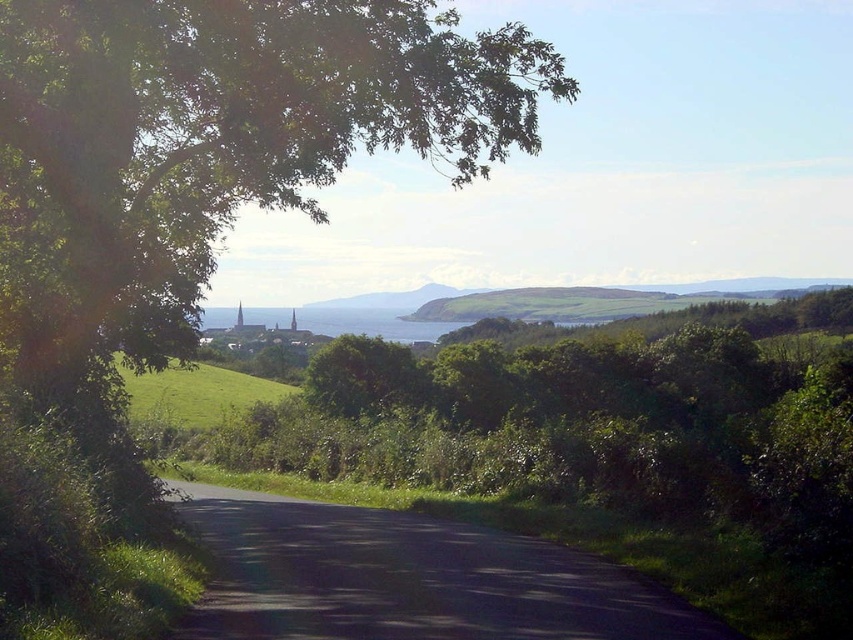
Question: Which point appears farthest from the camera in this image?

Choices:
 (A) (503, 557)
 (B) (450, 324)

Answer: (B)

Question: Among these objects, which one is nearest to the camera?

Choices:
 (A) black asphalt road at center
 (B) blue water at center

Answer: (A)

Question: Does black asphalt road at center have a larger size compared to blue water at center?

Choices:
 (A) yes
 (B) no

Answer: (B)

Question: In this image, where is black asphalt road at center located relative to blue water at center?

Choices:
 (A) right
 (B) left

Answer: (A)

Question: Does black asphalt road at center appear over blue water at center?

Choices:
 (A) yes
 (B) no

Answer: (B)